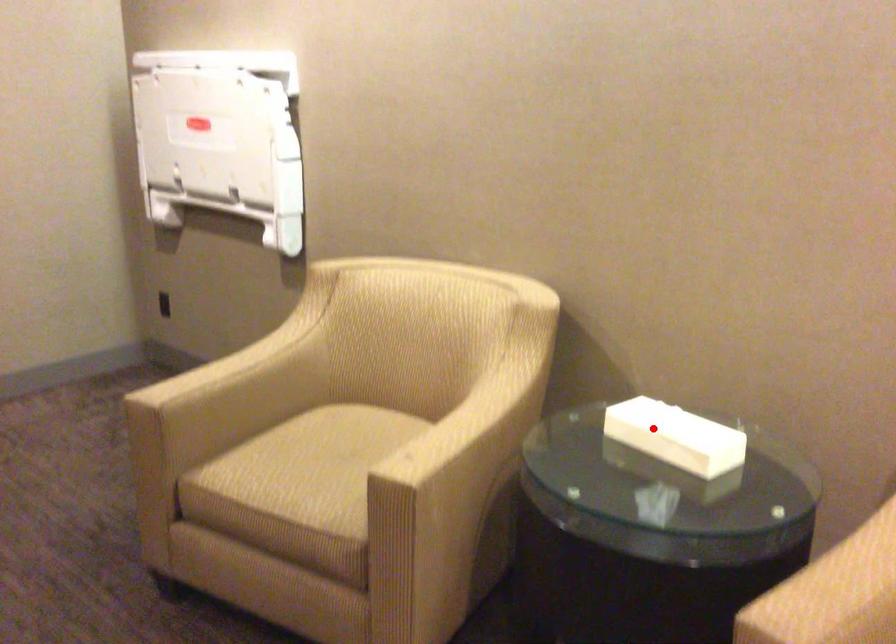
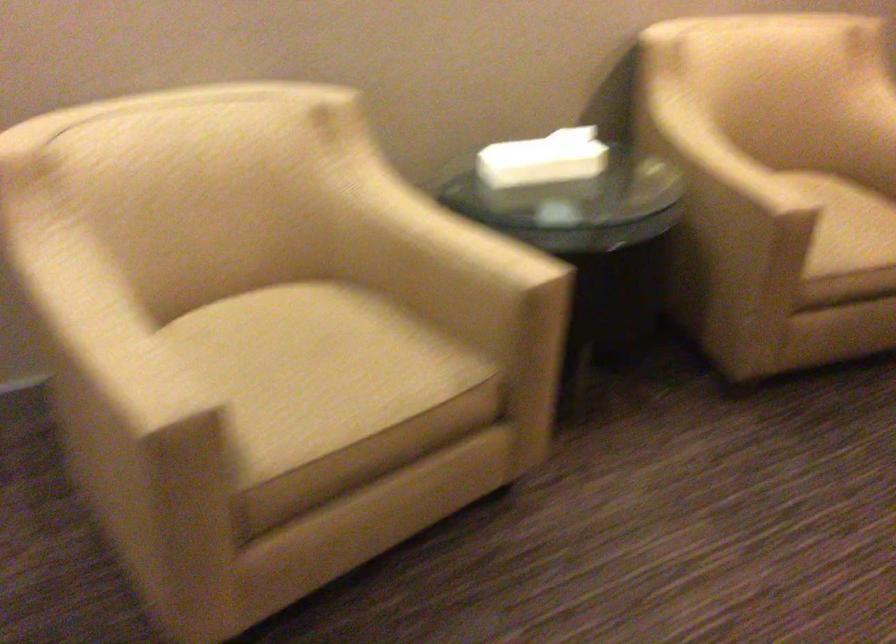
Question: I am providing you with two images of the same scene from different viewpoints. A red point is shown in image1. For the corresponding object point in image2, is it positioned nearer or farther from the camera?

Choices:
 (A) Nearer
 (B) Farther

Answer: (B)